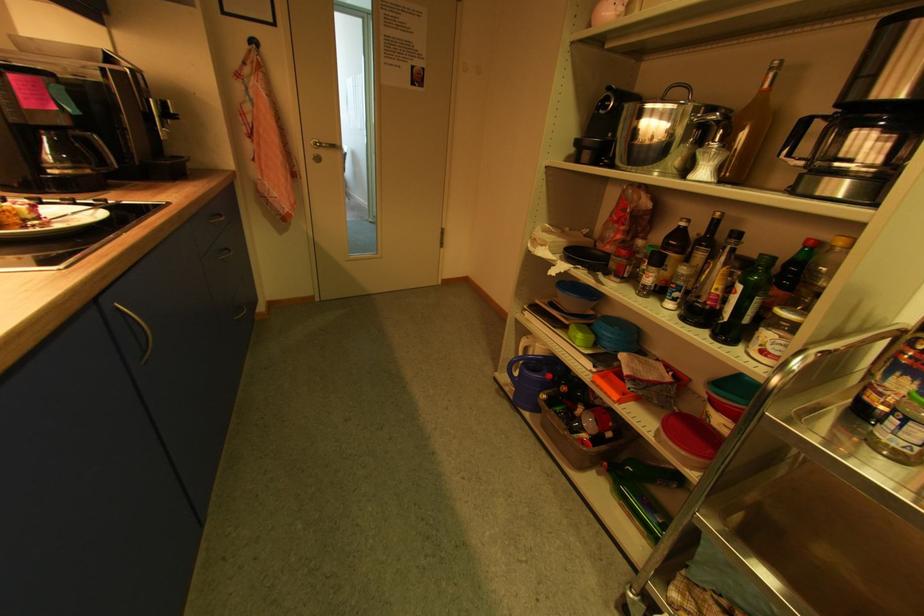
Locate an element on the screen. The image size is (924, 616). silver door handle is located at coordinates (327, 146).